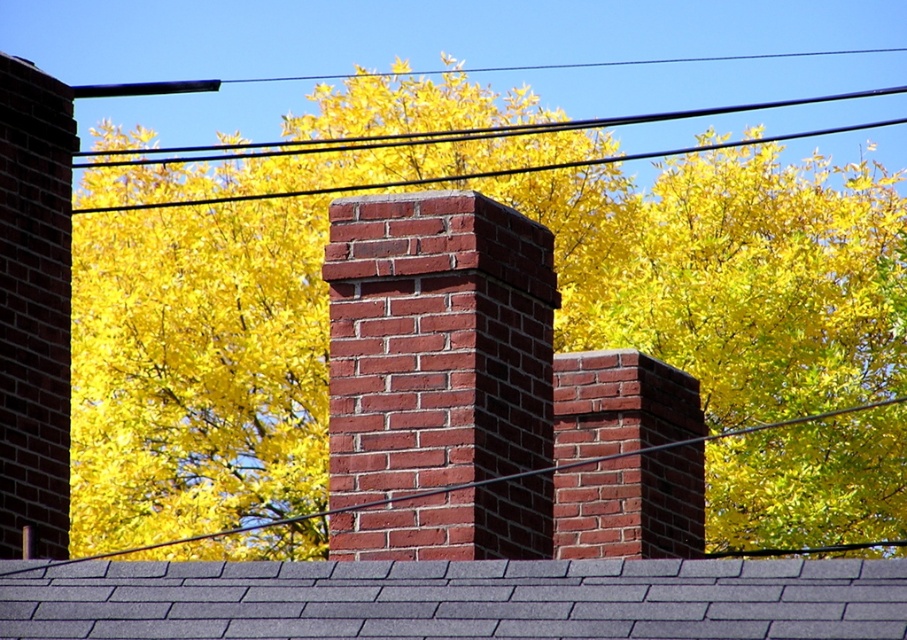
Question: Does red brick chimney at center appear on the left side of black wire at upper center?

Choices:
 (A) no
 (B) yes

Answer: (A)

Question: Is yellow leafy tree at upper center further to camera compared to black wire at upper center?

Choices:
 (A) no
 (B) yes

Answer: (B)

Question: Which object appears farthest from the camera in this image?

Choices:
 (A) gray shingles at center
 (B) black wire at upper center

Answer: (B)

Question: Among these points, which one is nearest to the camera?

Choices:
 (A) (340, 316)
 (B) (379, 630)

Answer: (B)

Question: Which point appears farthest from the camera in this image?

Choices:
 (A) (464, 237)
 (B) (681, 358)
 (C) (884, 88)

Answer: (C)

Question: Does gray shingles at center come in front of black wire at upper center?

Choices:
 (A) no
 (B) yes

Answer: (B)